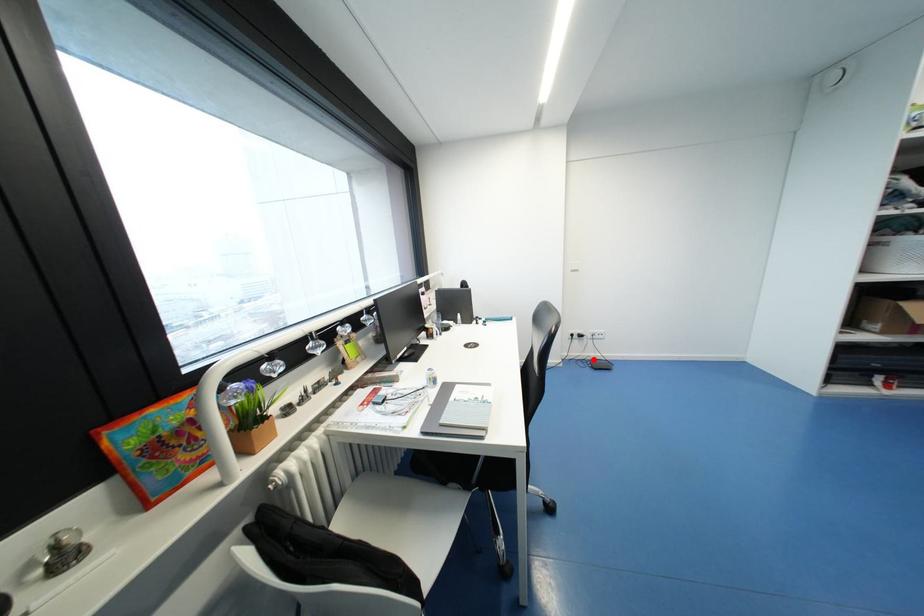
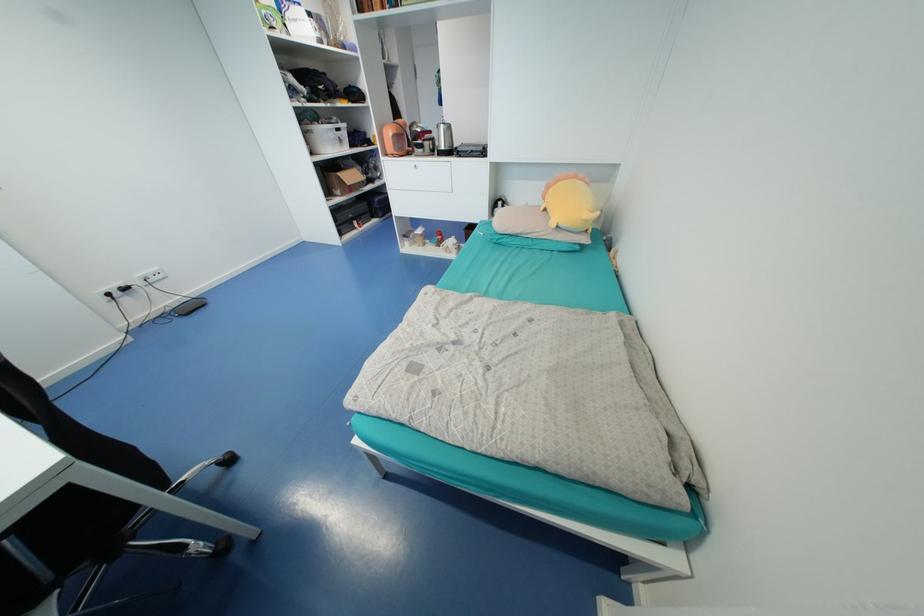
Question: I am providing you with two images of the same scene from different viewpoints. In image1, a red point is highlighted. Considering the same 3D point in image2, which of the following is correct?

Choices:
 (A) It is closer
 (B) It is farther

Answer: (A)